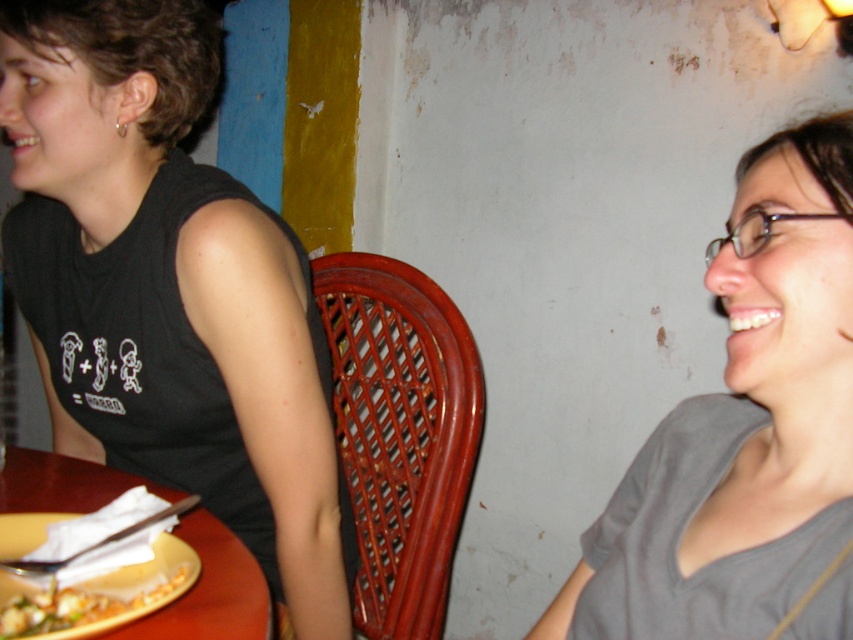
Question: Which object appears closest to the camera in this image?

Choices:
 (A) gray matte shirt at upper right
 (B) black matte tank top at left
 (C) wooden table at lower left

Answer: (A)

Question: Which object appears farthest from the camera in this image?

Choices:
 (A) gray matte shirt at upper right
 (B) yellow matte plate at lower left

Answer: (B)

Question: Among these objects, which one is farthest from the camera?

Choices:
 (A) black matte tank top at left
 (B) yellow matte plate at lower left
 (C) wooden table at lower left
 (D) gray matte shirt at upper right

Answer: (A)

Question: Does gray matte shirt at upper right have a lesser width compared to wooden table at lower left?

Choices:
 (A) no
 (B) yes

Answer: (B)

Question: Is black matte tank top at left above wooden table at lower left?

Choices:
 (A) yes
 (B) no

Answer: (A)

Question: Can you confirm if black matte tank top at left is wider than yellow matte plate at lower left?

Choices:
 (A) no
 (B) yes

Answer: (B)